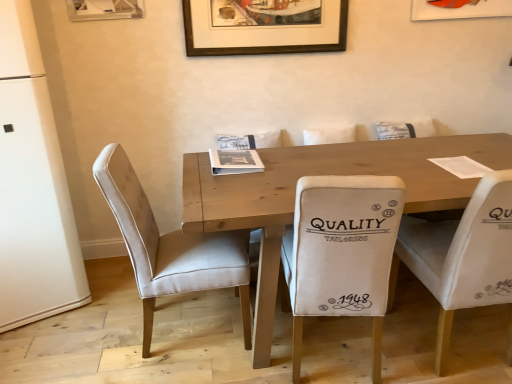
Question: From a real-world perspective, is beige fabric chair at center, the second chair in the right-to-left sequence, positioned over white fabric chair at right, acting as the 1th chair starting from the right, based on gravity?

Choices:
 (A) no
 (B) yes

Answer: (B)

Question: From the image's perspective, is beige fabric chair at center, positioned as the second chair in left-to-right order, on white fabric chair at right, acting as the 1th chair starting from the right?

Choices:
 (A) no
 (B) yes

Answer: (A)

Question: Is beige fabric chair at center, positioned as the second chair in left-to-right order, next to white fabric chair at right, arranged as the 3th chair when viewed from the left, and touching it?

Choices:
 (A) yes
 (B) no

Answer: (B)

Question: Is white fabric chair at right, arranged as the 3th chair when viewed from the left, a part of beige fabric chair at center, positioned as the second chair in left-to-right order?

Choices:
 (A) no
 (B) yes

Answer: (A)

Question: Does beige fabric chair at center, the second chair in the right-to-left sequence, lie in front of white fabric chair at right, acting as the 1th chair starting from the right?

Choices:
 (A) no
 (B) yes

Answer: (B)

Question: Considering the relative sizes of beige fabric chair at center, positioned as the second chair in left-to-right order, and white fabric chair at right, arranged as the 3th chair when viewed from the left, in the image provided, is beige fabric chair at center, positioned as the second chair in left-to-right order, thinner than white fabric chair at right, arranged as the 3th chair when viewed from the left,?

Choices:
 (A) yes
 (B) no

Answer: (B)

Question: Can you confirm if wooden table at center is positioned to the right of white fabric chair at right, arranged as the 3th chair when viewed from the left?

Choices:
 (A) no
 (B) yes

Answer: (A)

Question: Does wooden table at center have a larger size compared to white fabric chair at right, arranged as the 3th chair when viewed from the left?

Choices:
 (A) yes
 (B) no

Answer: (A)

Question: Is wooden table at center taller than white fabric chair at right, acting as the 1th chair starting from the right?

Choices:
 (A) no
 (B) yes

Answer: (A)

Question: Is wooden table at center oriented towards white fabric chair at right, arranged as the 3th chair when viewed from the left?

Choices:
 (A) no
 (B) yes

Answer: (B)

Question: From the image's perspective, would you say wooden table at center is shown under white fabric chair at right, arranged as the 3th chair when viewed from the left?

Choices:
 (A) yes
 (B) no

Answer: (B)

Question: Is there a large distance between wooden table at center and white fabric chair at right, acting as the 1th chair starting from the right?

Choices:
 (A) yes
 (B) no

Answer: (B)

Question: Is brown wooden picture frame at upper center thinner than beige velvet chair at left, which is the first chair from left to right?

Choices:
 (A) yes
 (B) no

Answer: (A)